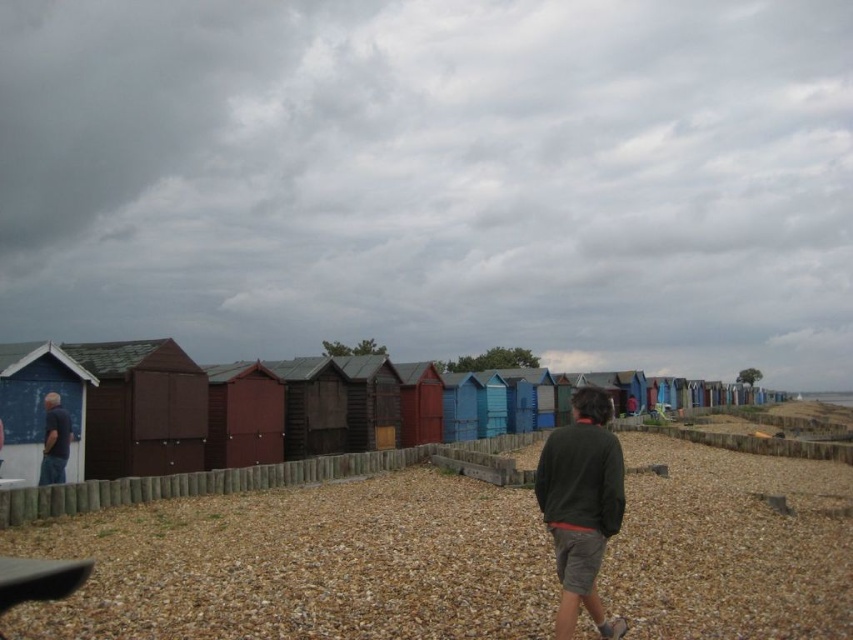
Looking at this image, you are standing on the pebble beach and looking at the cloudy sky at upper center and the matte blue shirt at left. Which one appears wider from your perspective?

The cloudy sky at upper center appears wider than the matte blue shirt at left because its width is larger.

You are standing on the pebble beach and see the cloudy sky at upper center and the dark green sweater at center. Which object is closer to you?

The dark green sweater at center is behind the cloudy sky at upper center, so the cloudy sky at upper center is closer to you.